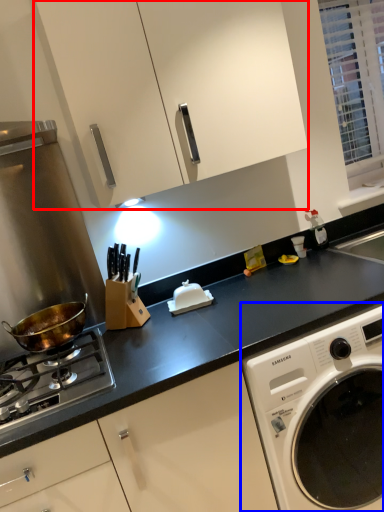
Question: Which of the following is the farthest to the observer, cabinetry (highlighted by a red box) or washing machine (highlighted by a blue box)?

Choices:
 (A) cabinetry
 (B) washing machine

Answer: (A)